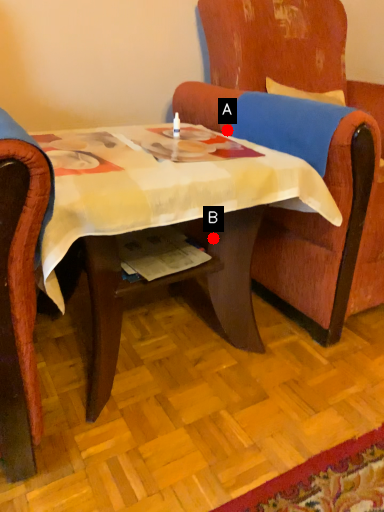
Question: Two points are circled on the image, labeled by A and B beside each circle. Among these points, which one is farthest from the camera?

Choices:
 (A) A is further
 (B) B is further

Answer: (A)